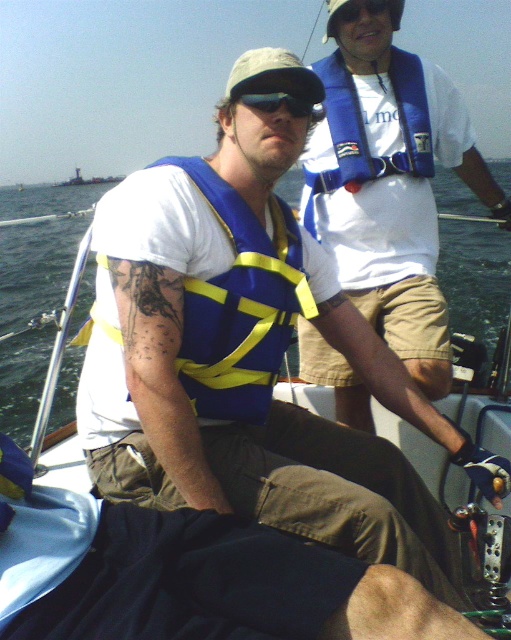
Question: Does blue fabric life vest at center lie behind blue/yellow fabric life vest at center?

Choices:
 (A) no
 (B) yes

Answer: (B)

Question: Considering the real-world distances, which object is closest to the black plastic goggles at center?

Choices:
 (A) blue fabric life vest at center
 (B) blue/yellow fabric life vest at center
 (C) blue/yellow life vest at center

Answer: (B)

Question: Which point appears closest to the camera in this image?

Choices:
 (A) (121, 182)
 (B) (2, 240)
 (C) (273, 93)
 (D) (353, 257)

Answer: (C)

Question: Which of these objects is positioned closest to the blue/yellow life vest at center?

Choices:
 (A) blue fabric life vest at center
 (B) blue/yellow fabric life vest at center
 (C) black plastic goggles at center

Answer: (B)

Question: Is blue fabric life vest at center to the left of blue/yellow life vest at center from the viewer's perspective?

Choices:
 (A) no
 (B) yes

Answer: (B)

Question: Where is blue/yellow fabric life vest at center located in relation to black plastic goggles at center in the image?

Choices:
 (A) below
 (B) above

Answer: (A)